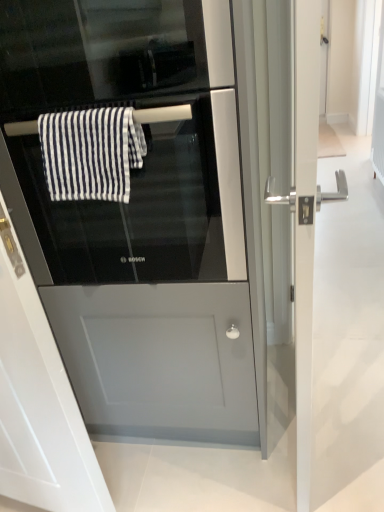
Question: Is satin silver fridge at center facing away from black glass screen door at center, placed as the second screen door when sorted from right to left?

Choices:
 (A) no
 (B) yes

Answer: (B)

Question: From a real-world perspective, does satin silver fridge at center stand above black glass screen door at center, placed as the second screen door when sorted from right to left?

Choices:
 (A) yes
 (B) no

Answer: (A)

Question: Can you confirm if satin silver fridge at center is smaller than black glass screen door at center, placed as the second screen door when sorted from right to left?

Choices:
 (A) yes
 (B) no

Answer: (B)

Question: Can you confirm if satin silver fridge at center is positioned to the left of black glass screen door at center, placed as the second screen door when sorted from right to left?

Choices:
 (A) no
 (B) yes

Answer: (A)

Question: Can you confirm if satin silver fridge at center is wider than black glass screen door at center, placed as the second screen door when sorted from right to left?

Choices:
 (A) yes
 (B) no

Answer: (A)

Question: From the image's perspective, is satin silver fridge at center under black glass screen door at center, placed as the second screen door when sorted from right to left?

Choices:
 (A) yes
 (B) no

Answer: (B)

Question: Are black glass oven at center and silver metallic door handle at right, marked as the 2th screen door in a left-to-right arrangement, far apart?

Choices:
 (A) yes
 (B) no

Answer: (B)

Question: Does black glass oven at center appear on the right side of silver metallic door handle at right, marked as the 2th screen door in a left-to-right arrangement?

Choices:
 (A) yes
 (B) no

Answer: (B)

Question: Is black glass oven at center taller than silver metallic door handle at right, positioned as the 1th screen door in right-to-left order?

Choices:
 (A) no
 (B) yes

Answer: (A)

Question: Considering the relative positions of black glass oven at center and silver metallic door handle at right, marked as the 2th screen door in a left-to-right arrangement, in the image provided, is black glass oven at center to the left of silver metallic door handle at right, marked as the 2th screen door in a left-to-right arrangement, from the viewer's perspective?

Choices:
 (A) yes
 (B) no

Answer: (A)

Question: Considering the relative sizes of black glass oven at center and silver metallic door handle at right, positioned as the 1th screen door in right-to-left order, in the image provided, is black glass oven at center shorter than silver metallic door handle at right, positioned as the 1th screen door in right-to-left order,?

Choices:
 (A) no
 (B) yes

Answer: (B)

Question: Does black glass oven at center have a larger size compared to silver metallic door handle at right, marked as the 2th screen door in a left-to-right arrangement?

Choices:
 (A) no
 (B) yes

Answer: (B)

Question: Is black glass oven at center at the right side of black glass screen door at center, placed as the second screen door when sorted from right to left?

Choices:
 (A) yes
 (B) no

Answer: (A)